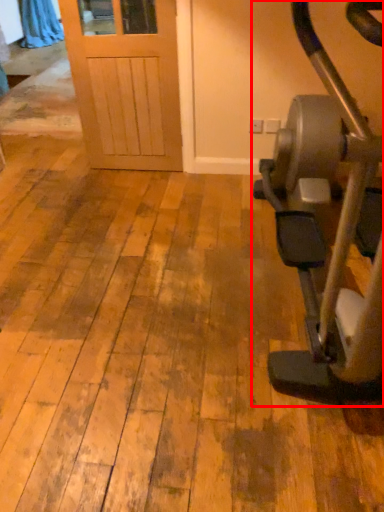
Question: Where is stationary bicycle (annotated by the red box) located in relation to curtain in the image?

Choices:
 (A) right
 (B) left

Answer: (A)